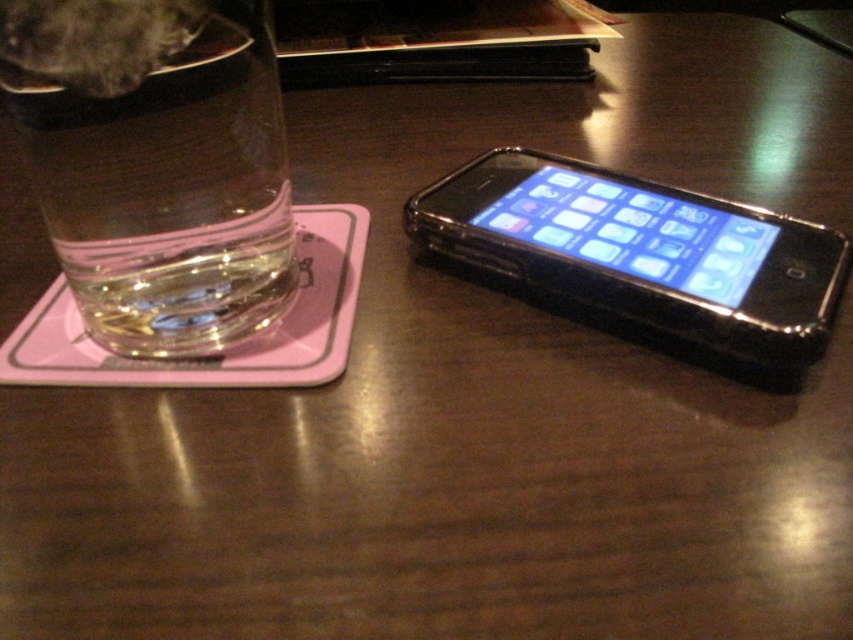
You are standing at the edge of the table looking towards the center. You see two points marked on the table surface labeled as point (170, 100) and point (781, 291). Which point is closer to you?

Point (170, 100) is closer to you because it is in front of point (781, 291).

You have a small toy car that is 10 cm long. You want to place it on the table between the clear glass at left and the black plastic smartphone at right. Can the toy car fit horizontally between them?

The clear glass at left is narrower than the black plastic smartphone at right. However, the exact distance between them isn not specified. Without knowing the space between the two objects, it is impossible to determine if the toy car can fit.

Please provide the 2D coordinates of the clear glass at left on the table surface.

The clear glass at left is located at the 2D coordinates of point (169, 192).